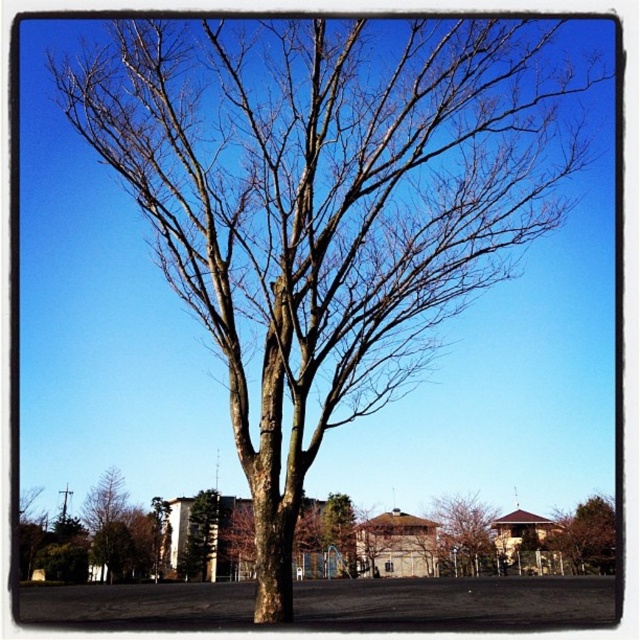
You are a bird looking for a place to perch. You see the brown rough bark tree at lower center and the green leafy tree at center. Which tree is shorter and better for a small bird like you?

The brown rough bark tree at lower center is shorter than the green leafy tree at center, so it is better for a small bird like you.

You are a city planner assessing a public space. You need to determine if the distance between the brown rough bark tree at lower center and the brown bark tree at lower left is sufficient to install a 50 feet long bench between them. Can you confirm if the distance allows for this installation?

The brown rough bark tree at lower center is 63.92 feet from the brown bark tree at lower left. Since the bench is 50 feet long, the distance between the trees is sufficient to accommodate the bench.

You are standing at the center of the image and want to walk straight to the brown rough bark tree at lower center. According to the coordinates provided, will you reach it before reaching the buildings in the background?

The brown rough bark tree at lower center is positioned at coordinates point [464,536], which is closer to the foreground than the buildings in the background. Therefore, you will reach the brown rough bark tree at lower center before the buildings in the background.